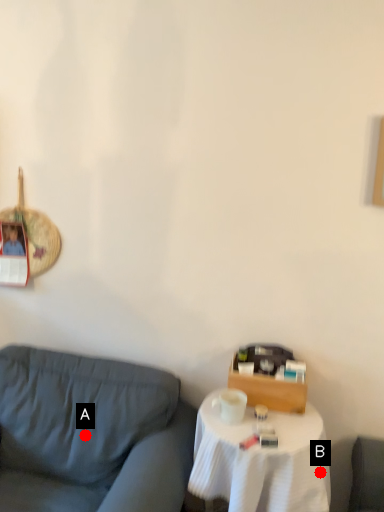
Question: Two points are circled on the image, labeled by A and B beside each circle. Among these points, which one is nearest to the camera?

Choices:
 (A) A is closer
 (B) B is closer

Answer: (B)